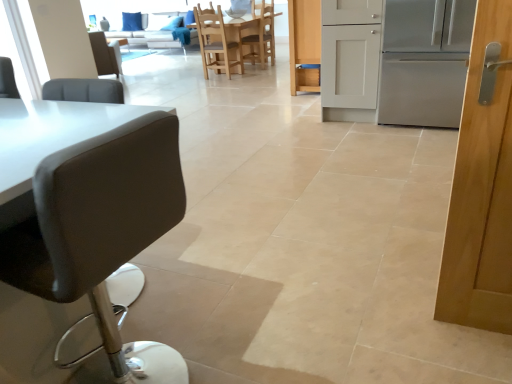
Image resolution: width=512 pixels, height=384 pixels. I want to click on black leather chair at upper left, marked as the 2th chair in a bottom-to-top arrangement, so click(x=105, y=54).

What do you see at coordinates (256, 36) in the screenshot?
I see `light wood table at center` at bounding box center [256, 36].

The height and width of the screenshot is (384, 512). What do you see at coordinates (304, 44) in the screenshot? I see `white wood cabinet at center` at bounding box center [304, 44].

Where is `light brown wooden chair at center, marked as the first chair in a top-to-bottom arrangement`? Image resolution: width=512 pixels, height=384 pixels. light brown wooden chair at center, marked as the first chair in a top-to-bottom arrangement is located at coordinates (261, 34).

What do you see at coordinates (160, 36) in the screenshot? I see `white fabric couch at upper center` at bounding box center [160, 36].

Where is `stainless steel refrigerator at right`? This screenshot has width=512, height=384. stainless steel refrigerator at right is located at coordinates (425, 61).

Where is `black leather chair at upper left, placed as the 3th chair when sorted from top to bottom`? The width and height of the screenshot is (512, 384). black leather chair at upper left, placed as the 3th chair when sorted from top to bottom is located at coordinates (105, 54).

From their relative heights in the image, would you say wooden chair at center, positioned as the second chair in front-to-back order, is taller or shorter than black leather chair at upper left, placed as the 3th chair when sorted from top to bottom?

wooden chair at center, positioned as the second chair in front-to-back order, is taller than black leather chair at upper left, placed as the 3th chair when sorted from top to bottom.

From a real-world perspective, is wooden chair at center, the 3th chair from the back, positioned over black leather chair at upper left, placed as the 3th chair when sorted from top to bottom, based on gravity?

Indeed, from a real-world perspective, wooden chair at center, the 3th chair from the back, stands above black leather chair at upper left, placed as the 3th chair when sorted from top to bottom.

Is wooden chair at center, the 3th chair in the bottom-to-top sequence, facing away from black leather chair at upper left, marked as the 1th chair in a left-to-right arrangement?

No, wooden chair at center, the 3th chair in the bottom-to-top sequence, is not facing away from black leather chair at upper left, marked as the 1th chair in a left-to-right arrangement.

Considering their positions, is light brown wooden chair at center, marked as the first chair in a top-to-bottom arrangement, located in front of or behind matte black stool at left, the 1th chair positioned from the bottom?

Clearly, light brown wooden chair at center, marked as the first chair in a top-to-bottom arrangement, is behind matte black stool at left, the 1th chair positioned from the bottom.

Is light brown wooden chair at center, placed as the fourth chair when sorted from left to right, facing towards matte black stool at left, the 2th chair positioned from the right?

No, light brown wooden chair at center, placed as the fourth chair when sorted from left to right, is not aimed at matte black stool at left, the 2th chair positioned from the right.

Between light brown wooden chair at center, marked as the 4th chair in a front-to-back arrangement, and matte black stool at left, positioned as the 3th chair in left-to-right order, which one has smaller size?

light brown wooden chair at center, marked as the 4th chair in a front-to-back arrangement, is smaller.

Which is correct: light brown wooden chair at center, the fourth chair in the bottom-to-top sequence, is inside matte black stool at left, which is the first chair in front-to-back order, or outside of it?

light brown wooden chair at center, the fourth chair in the bottom-to-top sequence, lies outside matte black stool at left, which is the first chair in front-to-back order.

Can you tell me how much black leather chair at upper left, placed as the second chair when sorted from back to front, and white wood cabinet at center differ in facing direction?

There is a 54.4-degree angle between the facing directions of black leather chair at upper left, placed as the second chair when sorted from back to front, and white wood cabinet at center.

Is black leather chair at upper left, which is counted as the 3th chair, starting from the front, bigger than white wood cabinet at center?

No.

From the picture: Does black leather chair at upper left, placed as the fourth chair when sorted from right to left, have a greater height compared to white wood cabinet at center?

In fact, black leather chair at upper left, placed as the fourth chair when sorted from right to left, may be shorter than white wood cabinet at center.

Could you tell me if black leather chair at upper left, placed as the second chair when sorted from back to front, is facing white wood cabinet at center?

No, black leather chair at upper left, placed as the second chair when sorted from back to front, does not turn towards white wood cabinet at center.

Which object is further away from the camera, light wood table at center or light brown wooden chair at center, marked as the 4th chair in a front-to-back arrangement?

light brown wooden chair at center, marked as the 4th chair in a front-to-back arrangement.

Does light wood table at center turn towards light brown wooden chair at center, arranged as the first chair when viewed from the right?

Yes, light wood table at center is oriented towards light brown wooden chair at center, arranged as the first chair when viewed from the right.

Considering the positions of objects light wood table at center and light brown wooden chair at center, placed as the first chair when sorted from back to front, in the image provided, who is more to the right, light wood table at center or light brown wooden chair at center, placed as the first chair when sorted from back to front,?

light brown wooden chair at center, placed as the first chair when sorted from back to front.

In the scene shown: From a real-world perspective, is light wood table at center below light brown wooden chair at center, placed as the first chair when sorted from back to front?

Yes, from a real-world perspective, light wood table at center is below light brown wooden chair at center, placed as the first chair when sorted from back to front.

Is stainless steel refrigerator at right inside the boundaries of white fabric couch at upper center, or outside?

stainless steel refrigerator at right is located beyond the bounds of white fabric couch at upper center.

Is stainless steel refrigerator at right beside white fabric couch at upper center?

No, stainless steel refrigerator at right is not touching white fabric couch at upper center.

How many degrees apart are the facing directions of stainless steel refrigerator at right and white fabric couch at upper center?

0.224 degrees separate the facing orientations of stainless steel refrigerator at right and white fabric couch at upper center.

Considering the sizes of objects stainless steel refrigerator at right and white fabric couch at upper center in the image provided, who is shorter, stainless steel refrigerator at right or white fabric couch at upper center?

white fabric couch at upper center is shorter.

From the image's perspective, who appears lower, stainless steel refrigerator at right or light wood table at center?

stainless steel refrigerator at right.

Considering the sizes of objects stainless steel refrigerator at right and light wood table at center in the image provided, who is bigger, stainless steel refrigerator at right or light wood table at center?

light wood table at center.

Could you tell me if stainless steel refrigerator at right is turned towards light wood table at center?

No, stainless steel refrigerator at right is not facing towards light wood table at center.

What's the angular difference between stainless steel refrigerator at right and light wood table at center's facing directions?

89.4 degrees separate the facing orientations of stainless steel refrigerator at right and light wood table at center.

Which object is further away from the camera, light brown wooden chair at center, marked as the 4th chair in a front-to-back arrangement, or black leather chair at upper left, which is counted as the 3th chair, starting from the front?

light brown wooden chair at center, marked as the 4th chair in a front-to-back arrangement, is further away from the camera.

Can black leather chair at upper left, marked as the 2th chair in a bottom-to-top arrangement, be found inside light brown wooden chair at center, placed as the first chair when sorted from back to front?

Actually, black leather chair at upper left, marked as the 2th chair in a bottom-to-top arrangement, is outside light brown wooden chair at center, placed as the first chair when sorted from back to front.

Is light brown wooden chair at center, marked as the first chair in a top-to-bottom arrangement, wider or thinner than black leather chair at upper left, which is counted as the 3th chair, starting from the front?

Clearly, light brown wooden chair at center, marked as the first chair in a top-to-bottom arrangement, has less width compared to black leather chair at upper left, which is counted as the 3th chair, starting from the front.

Find the location of a particular element. The width and height of the screenshot is (512, 384). chair that is the 1st object located in front of the black leather chair at upper left, which is counted as the 3th chair, starting from the front is located at coordinates (215, 42).

From a real-world perspective, starting from the light brown wooden chair at center, the fourth chair in the bottom-to-top sequence, which chair is the 2nd one below it? Please provide its 2D coordinates.

[(101, 227)]

From the image, which object appears to be nearer to light wood table at center, matte black stool at left, which is counted as the 4th chair, starting from the top, or light brown wooden chair at center, marked as the 4th chair in a front-to-back arrangement?

light brown wooden chair at center, marked as the 4th chair in a front-to-back arrangement, lies closer to light wood table at center than the other object.

When comparing their distances from black leather chair at upper left, marked as the 2th chair in a bottom-to-top arrangement, does light brown wooden chair at center, marked as the 4th chair in a front-to-back arrangement, or matte black stool at left, acting as the fourth chair starting from the back, seem closer?

Among the two, light brown wooden chair at center, marked as the 4th chair in a front-to-back arrangement, is located nearer to black leather chair at upper left, marked as the 2th chair in a bottom-to-top arrangement.

Considering their positions, is stainless steel refrigerator at right positioned closer to light wood table at center than white wood cabinet at center?

white wood cabinet at center is positioned closer to the anchor light wood table at center.

When comparing their distances from white wood cabinet at center, does black leather chair at upper left, placed as the fourth chair when sorted from right to left, or wooden chair at center, positioned as the second chair in front-to-back order, seem closer?

wooden chair at center, positioned as the second chair in front-to-back order.

From the picture: Considering their positions, is light wood table at center positioned further to white fabric couch at upper center than white wood cabinet at center?

The object further to white fabric couch at upper center is white wood cabinet at center.

Considering their positions, is black leather chair at upper left, marked as the 1th chair in a left-to-right arrangement, positioned further to light wood table at center than white fabric couch at upper center?

white fabric couch at upper center is further to light wood table at center.

From the image, which object appears to be nearer to matte black stool at left, which is the first chair in front-to-back order, stainless steel refrigerator at right or light brown wooden chair at center, arranged as the first chair when viewed from the right?

stainless steel refrigerator at right is positioned closer to the anchor matte black stool at left, which is the first chair in front-to-back order.

From the image, which object appears to be farther from white wood cabinet at center, white fabric couch at upper center or light wood table at center?

white fabric couch at upper center is further to white wood cabinet at center.

This screenshot has width=512, height=384. I want to click on oven between matte black stool at left, the 1th chair positioned from the bottom, and wooden chair at center, positioned as the second chair in front-to-back order, along the z-axis, so click(x=425, y=61).

This screenshot has width=512, height=384. What are the coordinates of `cabinetry positioned between matte black stool at left, the 1th chair positioned from the bottom, and white fabric couch at upper center from near to far` in the screenshot? It's located at click(304, 44).

The height and width of the screenshot is (384, 512). I want to click on oven positioned between matte black stool at left, which is the first chair in front-to-back order, and light brown wooden chair at center, the fourth chair in the bottom-to-top sequence, from near to far, so click(425, 61).

At what (x,y) coordinates should I click in order to perform the action: click on cabinetry located between stainless steel refrigerator at right and light wood table at center in the depth direction. Please return your answer as a coordinate pair (x, y). The image size is (512, 384). Looking at the image, I should click on (304, 44).